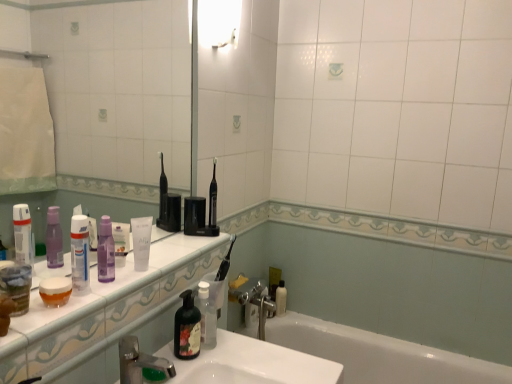
This screenshot has height=384, width=512. Find the location of `free space that is in between black plastic toothbrush at center and translucent plastic jar at lower left, which ranks as the 1th mouthwash in left-to-right order`. free space that is in between black plastic toothbrush at center and translucent plastic jar at lower left, which ranks as the 1th mouthwash in left-to-right order is located at coordinates (151, 264).